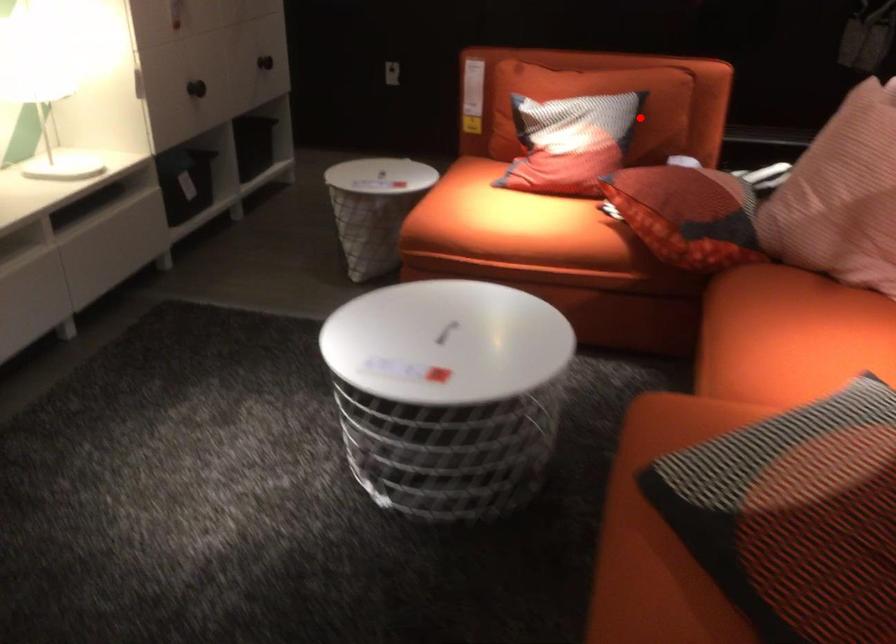
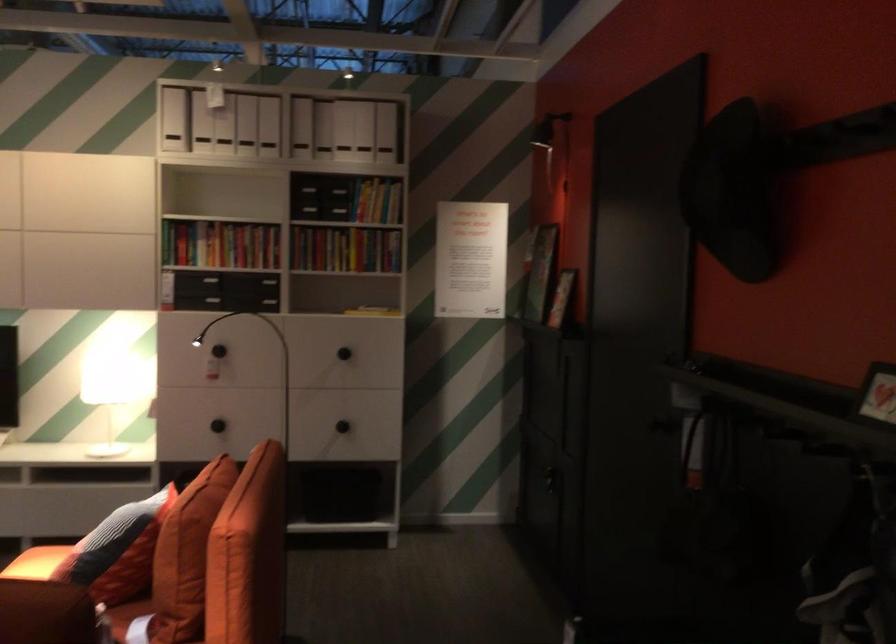
Question: I am providing you with two images of the same scene from different viewpoints. Given a red point in image1, look at the same physical point in image2. Is it:

Choices:
 (A) Closer to the viewpoint
 (B) Farther from the viewpoint

Answer: (A)